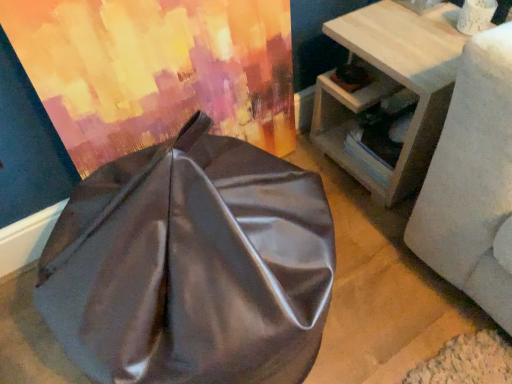
Question: Considering the relative sizes of satin fabric curtain at upper left and light wood side table at right in the image provided, is satin fabric curtain at upper left smaller than light wood side table at right?

Choices:
 (A) no
 (B) yes

Answer: (B)

Question: Is satin fabric curtain at upper left next to light wood side table at right and touching it?

Choices:
 (A) yes
 (B) no

Answer: (B)

Question: Does satin fabric curtain at upper left appear on the left side of light wood side table at right?

Choices:
 (A) yes
 (B) no

Answer: (A)

Question: Is light wood side table at right completely or partially inside satin fabric curtain at upper left?

Choices:
 (A) no
 (B) yes

Answer: (A)

Question: From a real-world perspective, is satin fabric curtain at upper left located beneath light wood side table at right?

Choices:
 (A) no
 (B) yes

Answer: (A)

Question: Is satin fabric curtain at upper left looking in the opposite direction of light wood side table at right?

Choices:
 (A) yes
 (B) no

Answer: (B)

Question: Is satin gray bean bag at center bigger than satin fabric curtain at upper left?

Choices:
 (A) no
 (B) yes

Answer: (B)

Question: Is satin gray bean bag at center wider than satin fabric curtain at upper left?

Choices:
 (A) yes
 (B) no

Answer: (A)

Question: From a real-world perspective, is satin gray bean bag at center below satin fabric curtain at upper left?

Choices:
 (A) yes
 (B) no

Answer: (A)

Question: Considering the relative sizes of satin gray bean bag at center and satin fabric curtain at upper left in the image provided, is satin gray bean bag at center thinner than satin fabric curtain at upper left?

Choices:
 (A) no
 (B) yes

Answer: (A)

Question: From a real-world perspective, is satin gray bean bag at center on top of satin fabric curtain at upper left?

Choices:
 (A) yes
 (B) no

Answer: (B)

Question: Considering the relative sizes of satin gray bean bag at center and satin fabric curtain at upper left in the image provided, is satin gray bean bag at center smaller than satin fabric curtain at upper left?

Choices:
 (A) yes
 (B) no

Answer: (B)

Question: Considering the relative sizes of satin fabric curtain at upper left and satin gray bean bag at center in the image provided, is satin fabric curtain at upper left wider than satin gray bean bag at center?

Choices:
 (A) no
 (B) yes

Answer: (A)